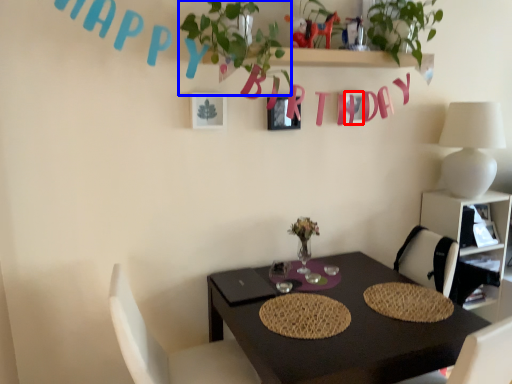
Question: Which point is closer to the camera, alphabet (highlighted by a red box) or plant (highlighted by a blue box)?

Choices:
 (A) alphabet
 (B) plant

Answer: (B)